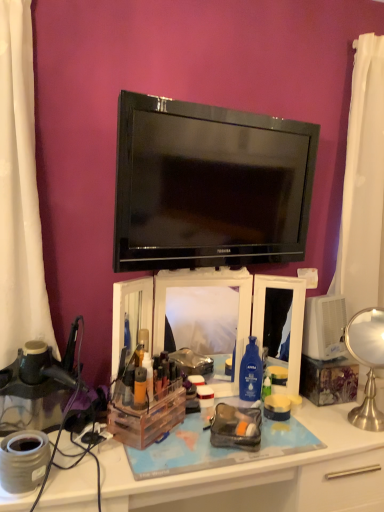
This screenshot has width=384, height=512. I want to click on vacant space in front of polished silver table lamp at right, so click(x=355, y=440).